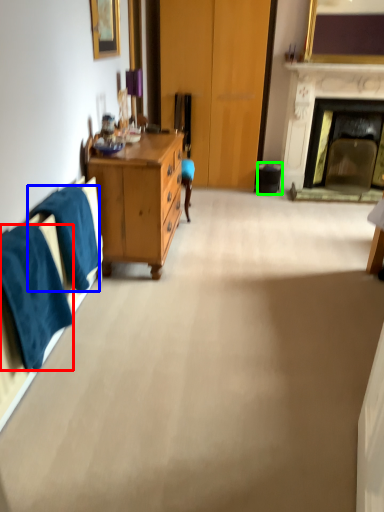
Question: Which object is positioned farthest from towel/napkin (highlighted by a red box)? Select from towel/napkin (highlighted by a blue box) and trash bin/can (highlighted by a green box).

Choices:
 (A) towel/napkin
 (B) trash bin/can

Answer: (B)